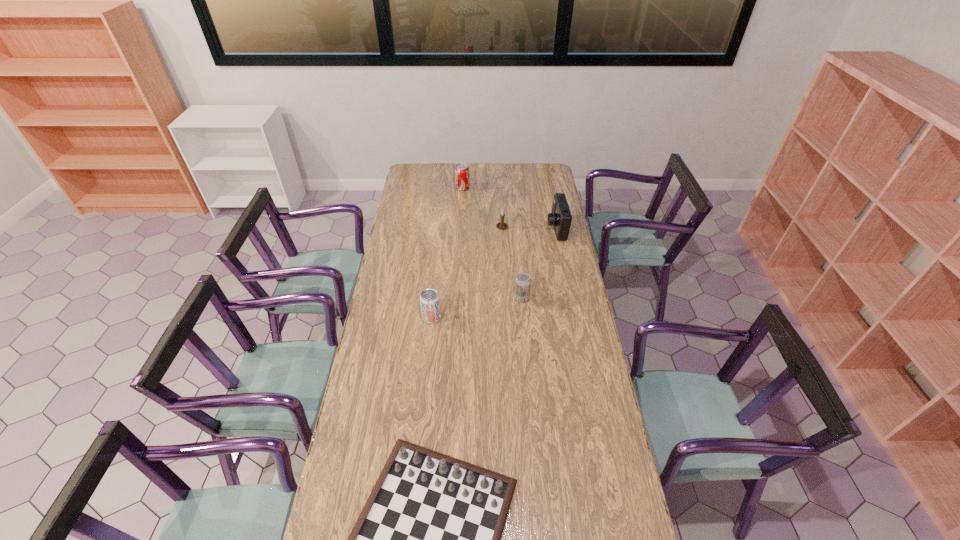
Find the location of a particular element. The image size is (960, 540). free point located on the front-facing side of the rightmost object is located at coordinates (490, 228).

Where is `blank space located on the left of the farthest object`? Image resolution: width=960 pixels, height=540 pixels. blank space located on the left of the farthest object is located at coordinates (441, 188).

The height and width of the screenshot is (540, 960). What are the coordinates of `free space located on the back of the fifth farthest object` in the screenshot? It's located at (436, 277).

The height and width of the screenshot is (540, 960). What are the coordinates of `vacant space located 0.250m on the left of the rightmost soda can` in the screenshot? It's located at (459, 298).

This screenshot has height=540, width=960. Identify the location of free space located 0.330m on the side of the candle holder with the handle. (505, 276).

Find the location of a particular element. The width and height of the screenshot is (960, 540). object present at the right edge is located at coordinates (560, 217).

In the image, there is a desktop. What are the coordinates of `free region at the far edge` in the screenshot? It's located at (453, 179).

Identify the location of free location at the left edge. (384, 321).

Identify the location of vacant area at the right edge of the desktop. 559,309.

Where is `vacant space at the far right corner of the desktop`? This screenshot has height=540, width=960. vacant space at the far right corner of the desktop is located at coordinates (534, 166).